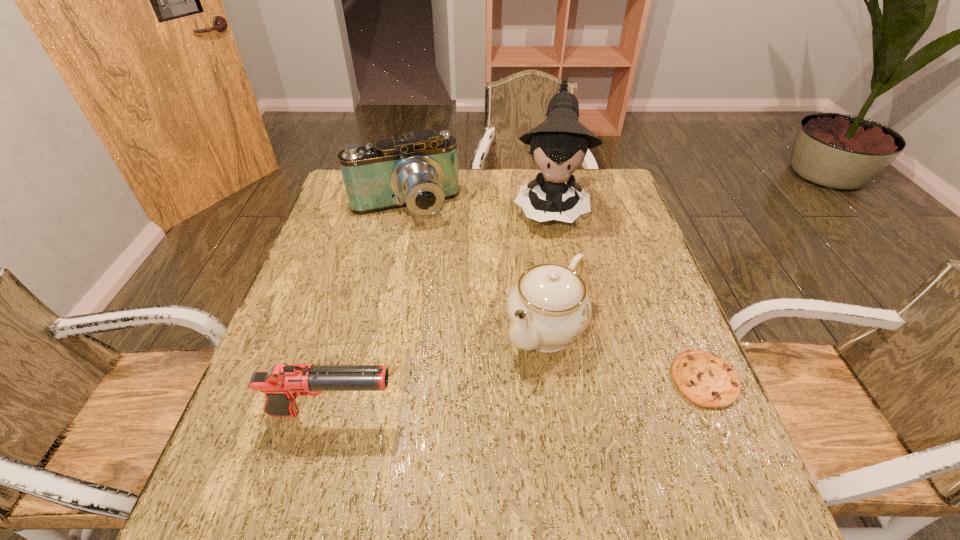
Identify the location of free space located at the face of the tallest object. (548, 287).

The image size is (960, 540). What are the coordinates of `vacant area situated at the spout of the chinaware` in the screenshot? It's located at (447, 449).

I want to click on vacant space located on the front-facing side of the camcorder, so click(434, 275).

You are a GUI agent. You are given a task and a screenshot of the screen. Output one action in this format:
    pyautogui.click(x=<x>, y=<y>)
    Task: Click on the blank space located 0.300m on the front-facing side of the camcorder
    The image size is (960, 540).
    Given the screenshot: What is the action you would take?
    pyautogui.click(x=443, y=299)

Find the location of a particular element. Image resolution: width=960 pixels, height=540 pixels. blank space located on the front-facing side of the camcorder is located at coordinates (x=431, y=268).

Where is `doll located in the far edge section of the desktop`? doll located in the far edge section of the desktop is located at coordinates (559, 145).

The width and height of the screenshot is (960, 540). I want to click on camcorder positioned at the far edge, so click(x=419, y=171).

Find the location of `object that is at the near edge`. object that is at the near edge is located at coordinates (282, 384).

This screenshot has width=960, height=540. I want to click on gun located in the left edge section of the desktop, so click(x=282, y=384).

Where is `camcorder that is at the left edge`? This screenshot has height=540, width=960. camcorder that is at the left edge is located at coordinates (419, 171).